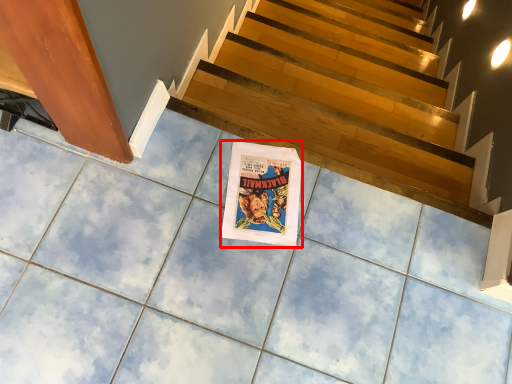
Question: Where is movie poster (annotated by the red box) located in relation to stairs in the image?

Choices:
 (A) left
 (B) right

Answer: (A)